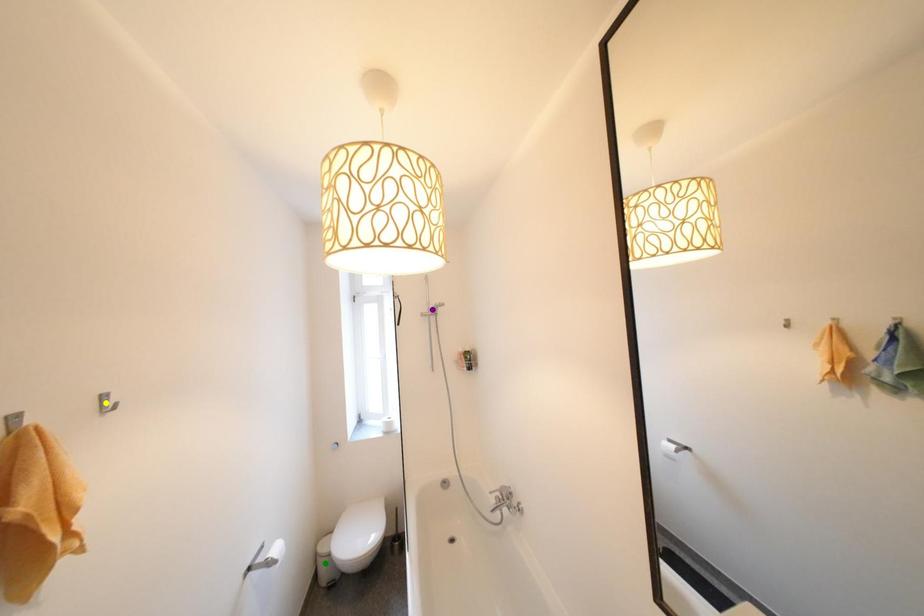
Order these from nearest to farthest:
green point | purple point | yellow point

yellow point → green point → purple point